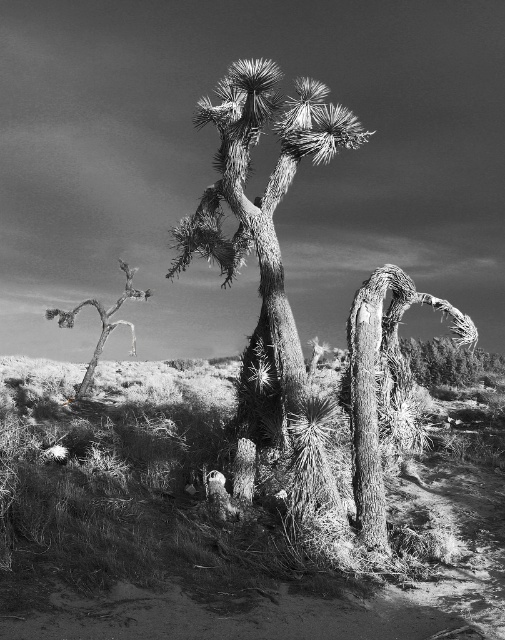
You are a botanist studying desert flora. You observe two trees in the scene, the rough bark joshua tree at center and the rough textured tree at center. Which one is positioned farther away from you?

The rough textured tree at center is positioned farther away from you because it is described as being behind the rough bark joshua tree at center.